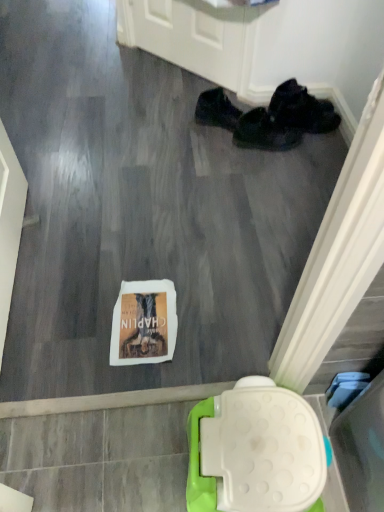
Locate an element on the screen. This screenshot has height=512, width=384. black fabric shoe at upper right, the third footwear viewed from the right is located at coordinates (217, 110).

Describe the element at coordinates (217, 110) in the screenshot. This screenshot has height=512, width=384. I see `black fabric shoe at upper right, the third footwear viewed from the right` at that location.

At what (x,y) coordinates should I click in order to perform the action: click on black fabric shoe at upper right, the third footwear viewed from the right. Please return your answer as a coordinate pair (x, y). This screenshot has height=512, width=384. Looking at the image, I should click on (217, 110).

Based on the photo, what's the angular difference between black fabric shoes at center, the second footwear positioned from the left, and black fabric shoes at upper right, the 1th footwear when ordered from right to left,'s facing directions?

They differ by 13.7 degrees in their facing directions.

Looking at this image, from a real-world perspective, is black fabric shoes at center, positioned as the 2th footwear in right-to-left order, above or below black fabric shoes at upper right, which is the 3th footwear in left-to-right order?

From a real-world perspective, black fabric shoes at center, positioned as the 2th footwear in right-to-left order, is physically below black fabric shoes at upper right, which is the 3th footwear in left-to-right order.

Who is taller, black fabric shoes at center, the second footwear positioned from the left, or black fabric shoes at upper right, which is the 3th footwear in left-to-right order?

black fabric shoes at center, the second footwear positioned from the left.

Is black fabric shoes at center, positioned as the 2th footwear in right-to-left order, located outside black fabric shoes at upper right, which is the 3th footwear in left-to-right order?

Yes, black fabric shoes at center, positioned as the 2th footwear in right-to-left order, is located beyond the bounds of black fabric shoes at upper right, which is the 3th footwear in left-to-right order.

Image resolution: width=384 pixels, height=512 pixels. Identify the location of the 1st footwear directly above the black fabric shoes at center, positioned as the 2th footwear in right-to-left order (from a real-world perspective). (217, 110).

Is black fabric shoes at center, positioned as the 2th footwear in right-to-left order, not near black fabric shoe at upper right, the third footwear viewed from the right?

That's not correct — black fabric shoes at center, positioned as the 2th footwear in right-to-left order, is a little close to black fabric shoe at upper right, the third footwear viewed from the right.

Considering the relative sizes of black fabric shoes at center, the second footwear positioned from the left, and black fabric shoe at upper right, the third footwear viewed from the right, in the image provided, is black fabric shoes at center, the second footwear positioned from the left, shorter than black fabric shoe at upper right, the third footwear viewed from the right,?

Indeed, black fabric shoes at center, the second footwear positioned from the left, has a lesser height compared to black fabric shoe at upper right, the third footwear viewed from the right.

From the image's perspective, is black fabric shoes at center, positioned as the 2th footwear in right-to-left order, below black fabric shoe at upper right, the third footwear viewed from the right?

Indeed, from the image's perspective, black fabric shoes at center, positioned as the 2th footwear in right-to-left order, is shown beneath black fabric shoe at upper right, the third footwear viewed from the right.

Looking at their sizes, would you say black fabric shoes at upper right, which is the 3th footwear in left-to-right order, is wider or thinner than black fabric shoe at upper right, which appears as the first footwear when viewed from the left?

In the image, black fabric shoes at upper right, which is the 3th footwear in left-to-right order, appears to be wider than black fabric shoe at upper right, which appears as the first footwear when viewed from the left.

Considering the relative positions of black fabric shoes at upper right, the 1th footwear when ordered from right to left, and black fabric shoe at upper right, the third footwear viewed from the right, in the image provided, is black fabric shoes at upper right, the 1th footwear when ordered from right to left, to the left of black fabric shoe at upper right, the third footwear viewed from the right, from the viewer's perspective?

No.

Are black fabric shoes at upper right, which is the 3th footwear in left-to-right order, and black fabric shoe at upper right, the third footwear viewed from the right, located far from each other?

No, black fabric shoes at upper right, which is the 3th footwear in left-to-right order, is in close proximity to black fabric shoe at upper right, the third footwear viewed from the right.

Would you say black fabric shoes at upper right, which is the 3th footwear in left-to-right order, is inside or outside black fabric shoe at upper right, the third footwear viewed from the right?

black fabric shoes at upper right, which is the 3th footwear in left-to-right order, is located beyond the bounds of black fabric shoe at upper right, the third footwear viewed from the right.

Is black fabric shoe at upper right, which appears as the first footwear when viewed from the left, oriented away from black fabric shoes at upper right, the 1th footwear when ordered from right to left?

That's not correct — black fabric shoe at upper right, which appears as the first footwear when viewed from the left, is not looking away from black fabric shoes at upper right, the 1th footwear when ordered from right to left.

You are a GUI agent. You are given a task and a screenshot of the screen. Output one action in this format:
    pyautogui.click(x=<x>, y=<y>)
    Task: Click on the 1st footwear below when counting from the black fabric shoes at upper right, the 1th footwear when ordered from right to left (from the image's perspective)
    The image size is (384, 512).
    Given the screenshot: What is the action you would take?
    217,110

Is black fabric shoe at upper right, the third footwear viewed from the right, positioned before black fabric shoes at upper right, which is the 3th footwear in left-to-right order?

Yes.

Between black fabric shoes at upper right, the 1th footwear when ordered from right to left, and black fabric shoes at center, the second footwear positioned from the left, which one has smaller width?

With smaller width is black fabric shoes at center, the second footwear positioned from the left.

In the scene shown: From a real-world perspective, relative to black fabric shoes at center, positioned as the 2th footwear in right-to-left order, is black fabric shoes at upper right, which is the 3th footwear in left-to-right order, vertically above or below?

In terms of real-world spatial position, black fabric shoes at upper right, which is the 3th footwear in left-to-right order, is above black fabric shoes at center, positioned as the 2th footwear in right-to-left order.

Who is shorter, black fabric shoes at upper right, which is the 3th footwear in left-to-right order, or black fabric shoes at center, positioned as the 2th footwear in right-to-left order?

Standing shorter between the two is black fabric shoes at upper right, which is the 3th footwear in left-to-right order.

In the scene shown: Which object is thinner, black fabric shoe at upper right, which appears as the first footwear when viewed from the left, or black fabric shoes at center, the second footwear positioned from the left?

black fabric shoes at center, the second footwear positioned from the left, is thinner.

Considering the positions of objects black fabric shoe at upper right, which appears as the first footwear when viewed from the left, and black fabric shoes at center, positioned as the 2th footwear in right-to-left order, in the image provided, who is more to the right, black fabric shoe at upper right, which appears as the first footwear when viewed from the left, or black fabric shoes at center, positioned as the 2th footwear in right-to-left order,?

black fabric shoes at center, positioned as the 2th footwear in right-to-left order.

From a real-world perspective, does black fabric shoe at upper right, which appears as the first footwear when viewed from the left, stand above black fabric shoes at center, the second footwear positioned from the left?

Indeed, from a real-world perspective, black fabric shoe at upper right, which appears as the first footwear when viewed from the left, stands above black fabric shoes at center, the second footwear positioned from the left.

Is black fabric shoe at upper right, the third footwear viewed from the right, not inside black fabric shoes at center, positioned as the 2th footwear in right-to-left order?

Yes, black fabric shoe at upper right, the third footwear viewed from the right, is outside of black fabric shoes at center, positioned as the 2th footwear in right-to-left order.

Where is `footwear that is the 2nd object located below the black fabric shoes at upper right, which is the 3th footwear in left-to-right order (from the image's perspective)`? Image resolution: width=384 pixels, height=512 pixels. footwear that is the 2nd object located below the black fabric shoes at upper right, which is the 3th footwear in left-to-right order (from the image's perspective) is located at coordinates (264, 132).

At what (x,y) coordinates should I click in order to perform the action: click on the 1st footwear counting from the right of the black fabric shoe at upper right, which appears as the first footwear when viewed from the left. Please return your answer as a coordinate pair (x, y). Looking at the image, I should click on (264, 132).

From the image, which object appears to be nearer to black fabric shoes at center, the second footwear positioned from the left, black fabric shoes at upper right, which is the 3th footwear in left-to-right order, or black fabric shoe at upper right, which appears as the first footwear when viewed from the left?

black fabric shoes at upper right, which is the 3th footwear in left-to-right order, is positioned closer to the anchor black fabric shoes at center, the second footwear positioned from the left.

Considering their positions, is black fabric shoes at center, positioned as the 2th footwear in right-to-left order, positioned further to black fabric shoes at upper right, which is the 3th footwear in left-to-right order, than black fabric shoe at upper right, the third footwear viewed from the right?

black fabric shoe at upper right, the third footwear viewed from the right.

Estimate the real-world distances between objects in this image. Which object is further from black fabric shoes at center, the second footwear positioned from the left, black fabric shoe at upper right, which appears as the first footwear when viewed from the left, or black fabric shoes at upper right, which is the 3th footwear in left-to-right order?

black fabric shoe at upper right, which appears as the first footwear when viewed from the left, lies further to black fabric shoes at center, the second footwear positioned from the left, than the other object.

Based on the photo, looking at the image, which one is located closer to black fabric shoe at upper right, which appears as the first footwear when viewed from the left, black fabric shoes at upper right, which is the 3th footwear in left-to-right order, or black fabric shoes at center, the second footwear positioned from the left?

black fabric shoes at center, the second footwear positioned from the left.

From the image, which object appears to be farther from black fabric shoes at upper right, the 1th footwear when ordered from right to left, black fabric shoe at upper right, which appears as the first footwear when viewed from the left, or black fabric shoes at center, positioned as the 2th footwear in right-to-left order?

black fabric shoe at upper right, which appears as the first footwear when viewed from the left, lies further to black fabric shoes at upper right, the 1th footwear when ordered from right to left, than the other object.

Considering their positions, is black fabric shoes at center, the second footwear positioned from the left, positioned further to black fabric shoe at upper right, the third footwear viewed from the right, than black fabric shoes at upper right, which is the 3th footwear in left-to-right order?

black fabric shoes at upper right, which is the 3th footwear in left-to-right order, is positioned further to the anchor black fabric shoe at upper right, the third footwear viewed from the right.

You are a GUI agent. You are given a task and a screenshot of the screen. Output one action in this format:
    pyautogui.click(x=<x>, y=<y>)
    Task: Click on the footwear between black fabric shoe at upper right, which appears as the first footwear when viewed from the left, and black fabric shoes at upper right, which is the 3th footwear in left-to-right order
    Image resolution: width=384 pixels, height=512 pixels.
    Given the screenshot: What is the action you would take?
    pyautogui.click(x=264, y=132)